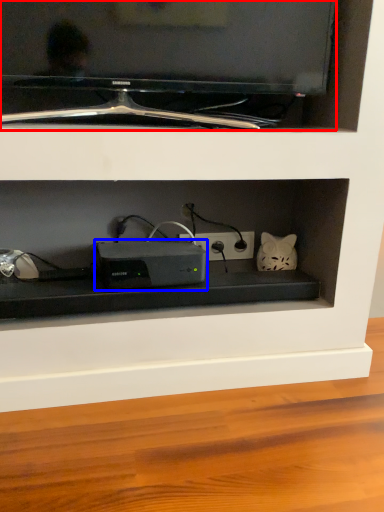
Question: Which object is further to the camera taking this photo, television (highlighted by a red box) or appliance (highlighted by a blue box)?

Choices:
 (A) television
 (B) appliance

Answer: (B)